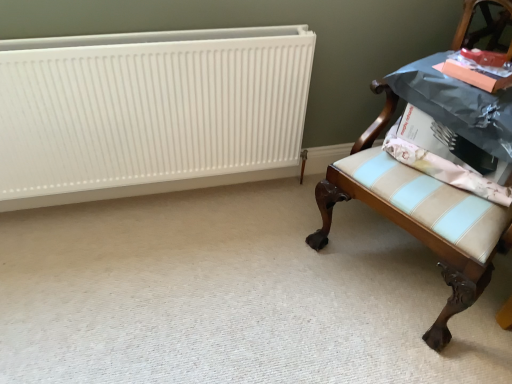
I want to click on vacant space underneath white matte radiator at upper left (from a real-world perspective), so click(123, 206).